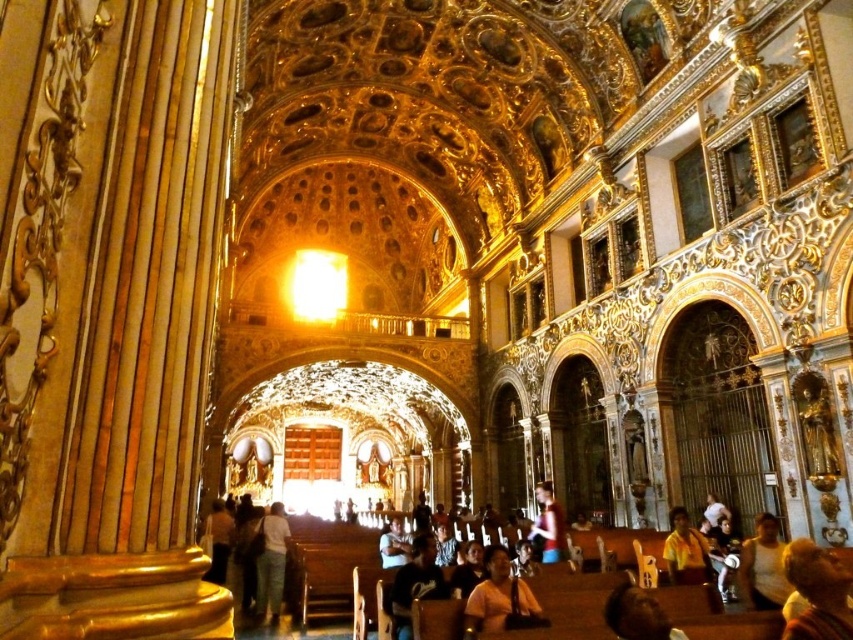
Is yellow fabric shirt at lower right further to camera compared to light blue denim shirt at center?

No, yellow fabric shirt at lower right is closer to the viewer.

Image resolution: width=853 pixels, height=640 pixels. Describe the element at coordinates (685, 552) in the screenshot. I see `yellow fabric shirt at lower right` at that location.

Where is `yellow fabric shirt at lower right`? This screenshot has width=853, height=640. yellow fabric shirt at lower right is located at coordinates (x=685, y=552).

Where is `yellow fabric shirt at lower right`? yellow fabric shirt at lower right is located at coordinates (685, 552).

Does orange t-shirt at lower center have a smaller size compared to light blue denim shirt at center?

Correct, orange t-shirt at lower center occupies less space than light blue denim shirt at center.

Can you confirm if orange t-shirt at lower center is taller than light blue denim shirt at center?

In fact, orange t-shirt at lower center may be shorter than light blue denim shirt at center.

Identify the location of orange t-shirt at lower center. This screenshot has width=853, height=640. (500, 598).

The width and height of the screenshot is (853, 640). What are the coordinates of `orange t-shirt at lower center` in the screenshot? It's located at (500, 598).

Does smooth golden hair at lower right have a smaller size compared to light blue denim shirt at center?

Yes, smooth golden hair at lower right is smaller than light blue denim shirt at center.

What do you see at coordinates (817, 593) in the screenshot?
I see `smooth golden hair at lower right` at bounding box center [817, 593].

From the picture: Who is more forward, [820,628] or [554,508]?

Point [820,628] is in front.

Where is `smooth golden hair at lower right`? Image resolution: width=853 pixels, height=640 pixels. smooth golden hair at lower right is located at coordinates (817, 593).